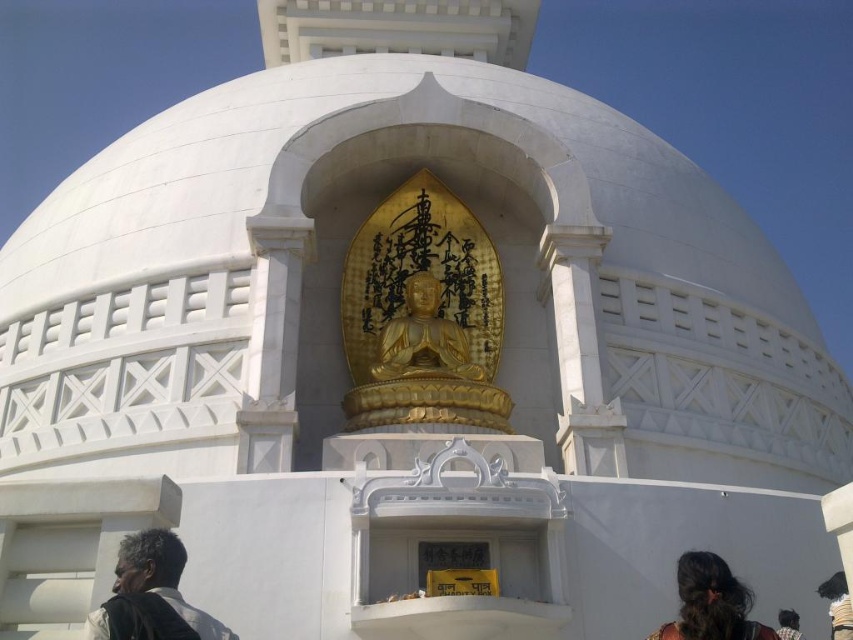
Question: Considering the relative positions of goldmaterial/texturebuddha at center and gold polished statue at center in the image provided, where is goldmaterial/texturebuddha at center located with respect to gold polished statue at center?

Choices:
 (A) left
 (B) right

Answer: (A)

Question: Which point appears closest to the camera in this image?

Choices:
 (A) click(788, 636)
 (B) click(819, 595)
 (C) click(90, 632)

Answer: (C)

Question: Which point is closer to the camera taking this photo?

Choices:
 (A) (782, 637)
 (B) (434, 364)
 (C) (741, 611)

Answer: (C)

Question: Can you confirm if black fabric at lower right is positioned to the right of black fabric headscarf at lower right?

Choices:
 (A) yes
 (B) no

Answer: (A)

Question: Can you confirm if dark brown hair at lower center is thinner than black fabric at lower right?

Choices:
 (A) no
 (B) yes

Answer: (B)

Question: Which point is farther to the camera?

Choices:
 (A) dark brown hair at lower left
 (B) goldmaterial/texturebuddha at center
 (C) gold polished statue at center
 (D) black fabric at lower right

Answer: (C)